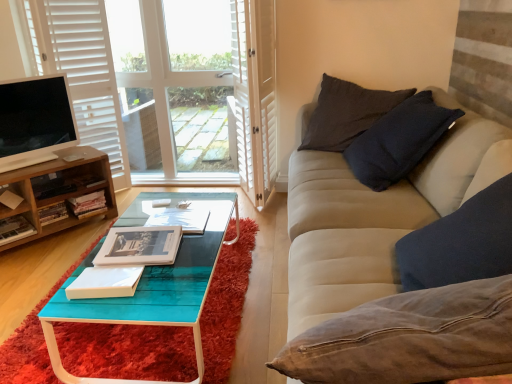
Question: Considering the relative sizes of hardcover book at center, the 7th book from the front, and hardcover book at center, which is counted as the fifth book, starting from the back, in the image provided, is hardcover book at center, the 7th book from the front, shorter than hardcover book at center, which is counted as the fifth book, starting from the back,?

Choices:
 (A) yes
 (B) no

Answer: (A)

Question: From the image's perspective, does hardcover book at center, the first book when ordered from back to front, appear higher than hardcover book at center, which is counted as the fifth book, starting from the back?

Choices:
 (A) yes
 (B) no

Answer: (A)

Question: From the image's perspective, is hardcover book at center, the 7th book from the front, under hardcover book at center, the third book when ordered from front to back?

Choices:
 (A) yes
 (B) no

Answer: (B)

Question: Can we say hardcover book at center, the first book when ordered from back to front, lies outside hardcover book at center, which is counted as the fifth book, starting from the back?

Choices:
 (A) yes
 (B) no

Answer: (A)

Question: Can you confirm if hardcover book at center, the first book when ordered from back to front, is positioned to the right of hardcover book at center, the third book when ordered from front to back?

Choices:
 (A) no
 (B) yes

Answer: (A)

Question: In terms of size, does white wood window at upper left appear bigger or smaller than hardcover books at left, the 2th book from the back?

Choices:
 (A) small
 (B) big

Answer: (B)

Question: Is white wood window at upper left situated inside hardcover books at left, the 6th book viewed from the front, or outside?

Choices:
 (A) outside
 (B) inside

Answer: (A)

Question: From the image's perspective, is white wood window at upper left above or below hardcover books at left, the 6th book viewed from the front?

Choices:
 (A) above
 (B) below

Answer: (A)

Question: In the image, is white wood window at upper left positioned in front of or behind hardcover books at left, the 2th book from the back?

Choices:
 (A) front
 (B) behind

Answer: (B)

Question: In terms of size, does hardcover book at center, the third book when ordered from front to back, appear bigger or smaller than hardcover book at lower left, the 4th book from the front?

Choices:
 (A) big
 (B) small

Answer: (B)

Question: Does point (188, 226) appear closer or farther from the camera than point (23, 226)?

Choices:
 (A) closer
 (B) farther

Answer: (A)

Question: In the image, is hardcover book at center, which is counted as the fifth book, starting from the back, positioned in front of or behind hardcover book at lower left, the 4th book from the front?

Choices:
 (A) behind
 (B) front

Answer: (B)

Question: From a real-world perspective, is hardcover book at center, the third book when ordered from front to back, above or below hardcover book at lower left, the 4th book from the front?

Choices:
 (A) below
 (B) above

Answer: (B)

Question: From a real-world perspective, is white paper book at center, which appears as the 1th book when viewed from the front, physically located above or below hardcover book at lower left, the 4th book from the front?

Choices:
 (A) above
 (B) below

Answer: (A)

Question: Is white paper book at center, which appears as the 1th book when viewed from the front, to the left or to the right of hardcover book at lower left, the 4th book from the front, in the image?

Choices:
 (A) right
 (B) left

Answer: (A)